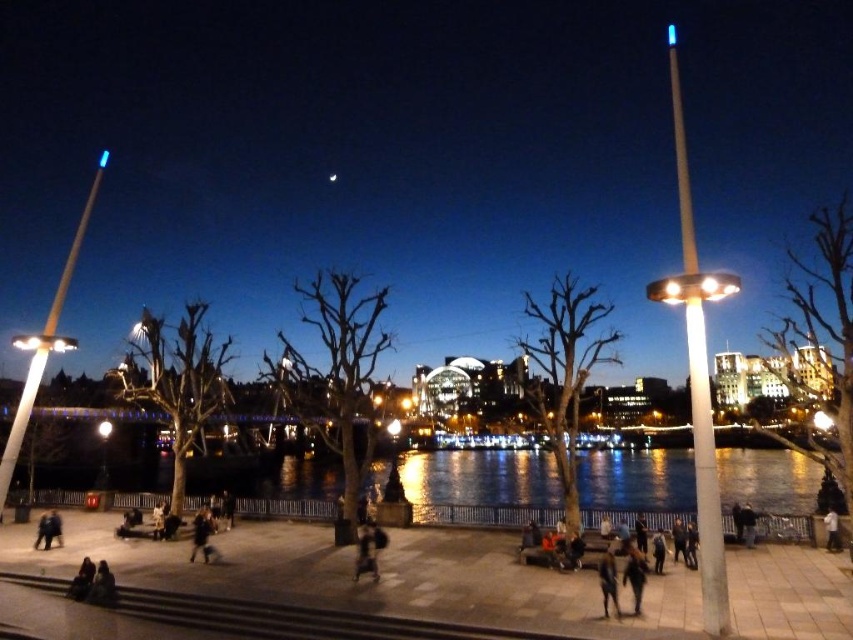
Question: Which of the following is the closest to the observer?

Choices:
 (A) black matte jacket at lower center
 (B) dark blue jeans at lower center

Answer: (A)

Question: From the image, what is the correct spatial relationship of black matte jacket at lower center in relation to dark blue jeans at lower center?

Choices:
 (A) right
 (B) left

Answer: (A)

Question: Can you confirm if black matte jacket at lower center is positioned to the right of dark blue jeans at lower center?

Choices:
 (A) yes
 (B) no

Answer: (A)

Question: Which point is farther to the camera?

Choices:
 (A) (640, 600)
 (B) (616, 616)

Answer: (A)

Question: Among these points, which one is nearest to the camera?

Choices:
 (A) (637, 596)
 (B) (607, 576)

Answer: (A)

Question: Can you confirm if black matte jacket at lower center is smaller than dark blue jeans at lower center?

Choices:
 (A) yes
 (B) no

Answer: (B)